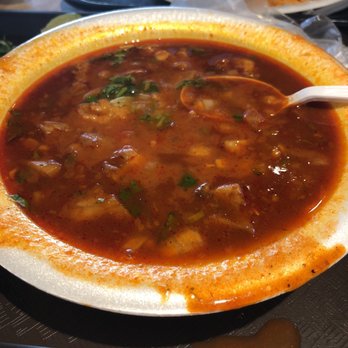
Locate an element on the screen. The width and height of the screenshot is (348, 348). spillage of orange liquid on dark gray table is located at coordinates (258, 340), (309, 314).